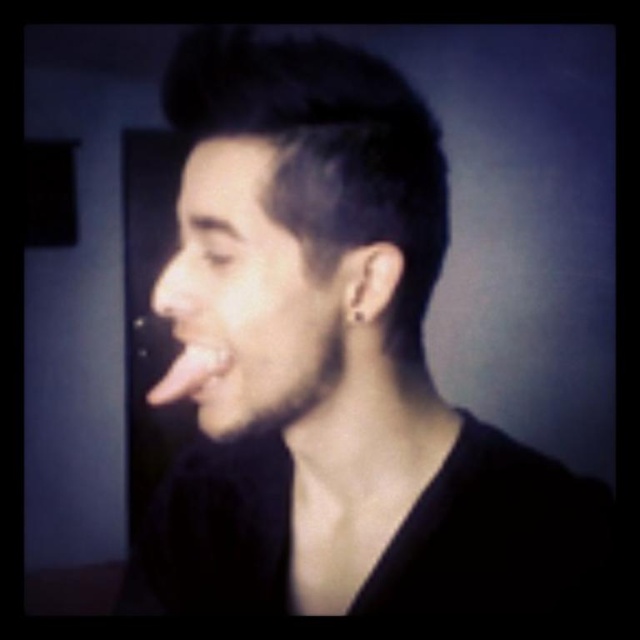
Question: Does smooth skin face at center have a larger size compared to smooth skin nose at center?

Choices:
 (A) yes
 (B) no

Answer: (B)

Question: Which point appears closest to the camera in this image?

Choices:
 (A) (170, 317)
 (B) (189, 387)
 (C) (374, 346)

Answer: (B)

Question: Among these points, which one is nearest to the camera?

Choices:
 (A) (173, 262)
 (B) (422, 145)
 (C) (230, 364)
 (D) (230, 209)

Answer: (D)

Question: Considering the relative positions of matte black shirt at center and pink flesh at center in the image provided, where is matte black shirt at center located with respect to pink flesh at center?

Choices:
 (A) right
 (B) left

Answer: (A)

Question: Which of these objects is positioned farthest from the smooth skin nose at center?

Choices:
 (A) smooth skin face at center
 (B) pink flesh at center
 (C) matte black shirt at center

Answer: (A)

Question: Is pink flesh at center closer to camera compared to smooth skin nose at center?

Choices:
 (A) yes
 (B) no

Answer: (B)